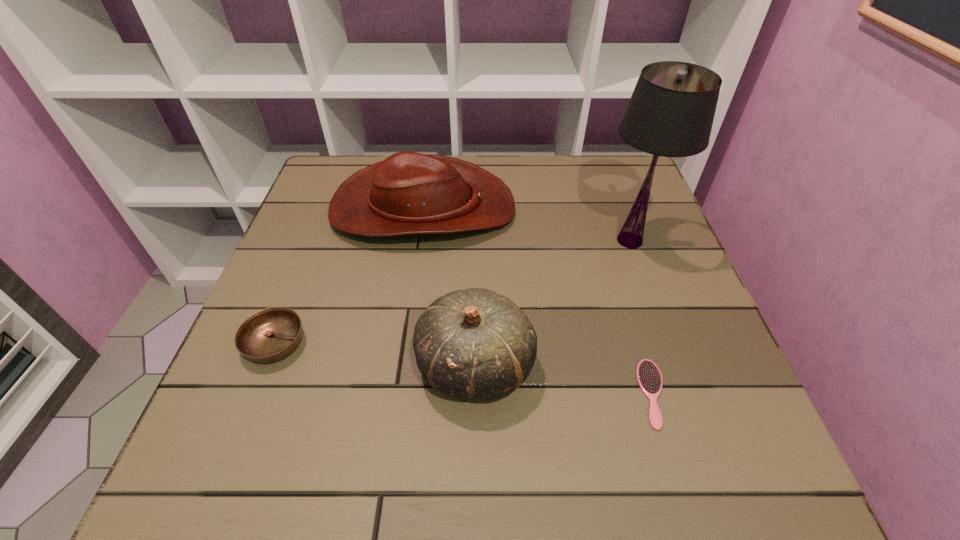
In order to click on lampshade in this screenshot , I will do `click(671, 111)`.

Locate an element on the screen. The image size is (960, 540). gourd is located at coordinates (474, 343).

Locate an element on the screen. The image size is (960, 540). cowboy hat is located at coordinates (408, 193).

Where is `soup bowl`? soup bowl is located at coordinates (271, 334).

You are a GUI agent. You are given a task and a screenshot of the screen. Output one action in this format:
    pyautogui.click(x=<x>, y=<y>)
    Task: Click on the shortest object
    
    Given the screenshot: What is the action you would take?
    pyautogui.click(x=649, y=378)

You are a GUI agent. You are given a task and a screenshot of the screen. Output one action in this format:
    pyautogui.click(x=<x>, y=<y>)
    Task: Click on the vacant point located on the front-facing side of the tallest object
    This screenshot has width=960, height=540.
    Given the screenshot: What is the action you would take?
    pyautogui.click(x=513, y=240)

Find the location of a particular element. This screenshot has height=540, width=960. free region located on the front-facing side of the tallest object is located at coordinates (470, 240).

This screenshot has width=960, height=540. Find the location of `vacant space located 0.180m on the front-facing side of the tallest object`. vacant space located 0.180m on the front-facing side of the tallest object is located at coordinates click(x=517, y=240).

Identify the location of free point located on the right of the gourd. The height and width of the screenshot is (540, 960). (594, 364).

Locate an element on the screen. free spot located on the front-facing side of the cowboy hat is located at coordinates (555, 208).